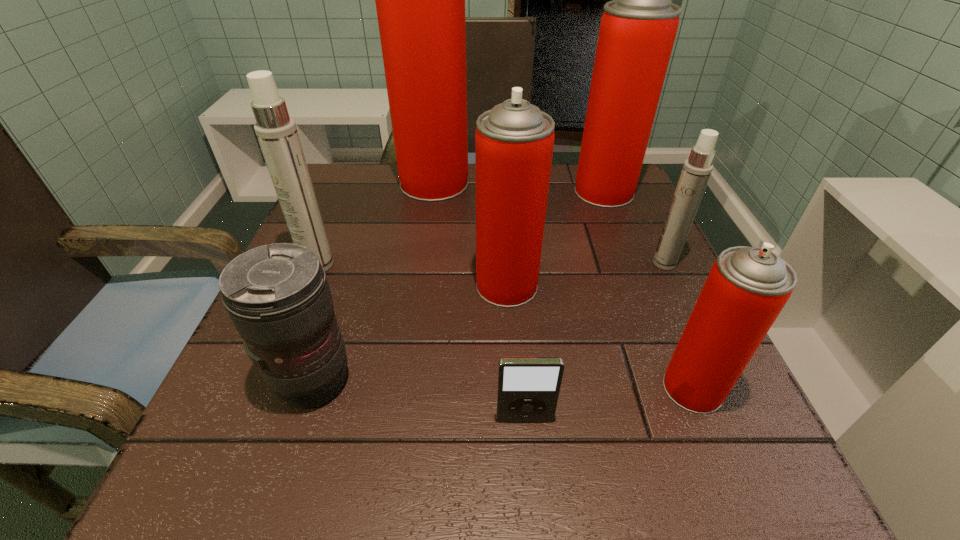
Locate an element on the screen. Image resolution: width=960 pixels, height=540 pixels. the nearest red aerosol can is located at coordinates (747, 287).

Find the location of a particular element. The height and width of the screenshot is (540, 960). the second shortest object is located at coordinates pyautogui.click(x=278, y=297).

The height and width of the screenshot is (540, 960). Find the location of `iPod`. iPod is located at coordinates (528, 388).

The image size is (960, 540). I want to click on vacant space located 0.090m on the left of the biggest red aerosol can, so click(x=364, y=183).

You are a GUI agent. You are given a task and a screenshot of the screen. Output one action in this format:
    pyautogui.click(x=<x>, y=<y>)
    Task: Click on the vacant space located 0.070m on the front of the second biggest red aerosol can
    
    Given the screenshot: What is the action you would take?
    pyautogui.click(x=617, y=226)

I want to click on vacant space located 0.180m on the right of the third aerosol can from left to right, so click(635, 286).

You are a GUI agent. You are given a task and a screenshot of the screen. Output one action in this format:
    pyautogui.click(x=<x>, y=<y>)
    Task: Click on the vacant region located on the right of the bigger white aerosol can
    
    Given the screenshot: What is the action you would take?
    pyautogui.click(x=436, y=265)

You are a GUI agent. You are given a task and a screenshot of the screen. Output one action in this format:
    pyautogui.click(x=<x>, y=<y>)
    Task: Click on the free point located on the front of the smaller white aerosol can
    The height and width of the screenshot is (540, 960).
    Given the screenshot: What is the action you would take?
    (x=722, y=384)

At what (x,y) coordinates should I click in order to perform the action: click on free spot located on the back of the nearest red aerosol can. Please return your answer as a coordinate pair (x, y). The width and height of the screenshot is (960, 540). Looking at the image, I should click on (630, 238).

The image size is (960, 540). What are the coordinates of `vacant space located 0.170m on the side of the telephoto lens where the control switches are located` in the screenshot? It's located at (467, 380).